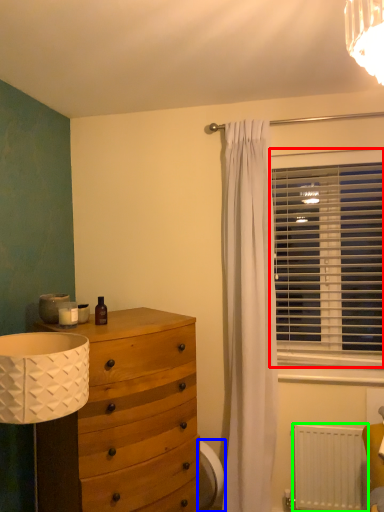
Question: Which object is the closest to the window blind (highlighted by a red box)? Choose among these: swivel chair (highlighted by a blue box) or radiator (highlighted by a green box).

Choices:
 (A) swivel chair
 (B) radiator

Answer: (B)